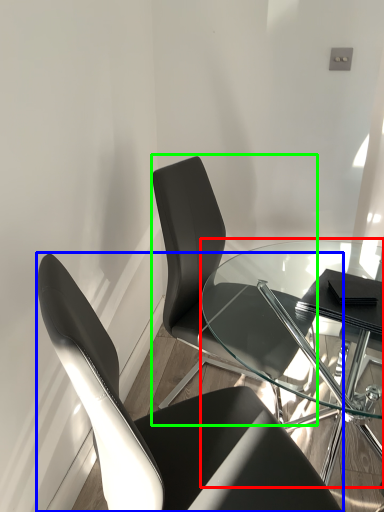
Question: Which object is positioned farthest from table (highlighted by a red box)? Select from chair (highlighted by a blue box) and chair (highlighted by a green box).

Choices:
 (A) chair
 (B) chair

Answer: (A)